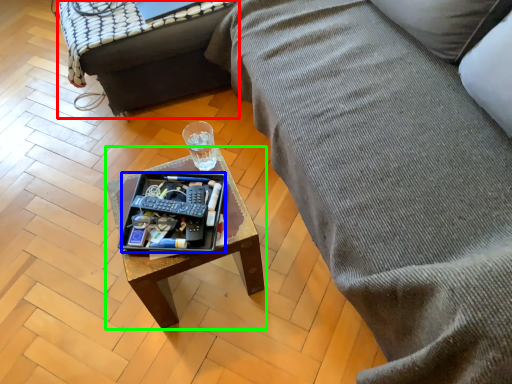
Question: Considering the real-world distances, which object is farthest from table (highlighted by a red box)? tray (highlighted by a blue box) or coffee table (highlighted by a green box)?

Choices:
 (A) tray
 (B) coffee table

Answer: (A)